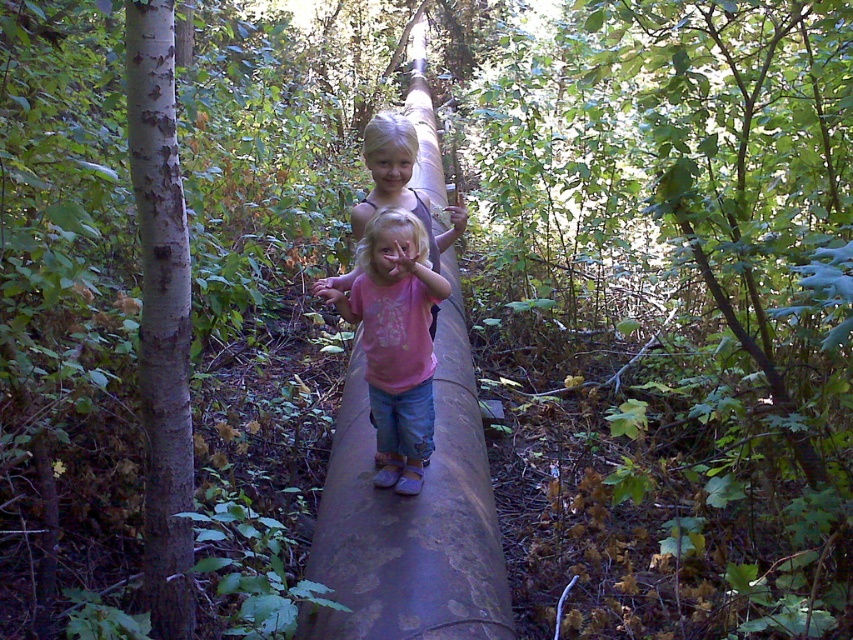
Can you confirm if rusty metal log at center is positioned below white rough bark at left?

No, rusty metal log at center is not below white rough bark at left.

Which of these two, rusty metal log at center or white rough bark at left, stands shorter?

Standing shorter between the two is white rough bark at left.

Does point (459, 410) lie in front of point (158, 166)?

No, it is behind (158, 166).

The width and height of the screenshot is (853, 640). In order to click on rusty metal log at center in this screenshot , I will do `click(412, 518)`.

Does point (151, 92) lie behind point (428, 228)?

That is False.

Who is more distant from viewer, (175, 404) or (364, 204)?

The point (364, 204) is more distant.

Measure the distance between point (164, 568) and camera.

A distance of 7.51 feet exists between point (164, 568) and camera.

This screenshot has width=853, height=640. Identify the location of white rough bark at left. (161, 314).

Is rusty metal log at center to the right of matte pink shirt at center from the viewer's perspective?

No, rusty metal log at center is not to the right of matte pink shirt at center.

Can you confirm if rusty metal log at center is taller than matte pink shirt at center?

Yes.

Does point (467, 444) come in front of point (433, 448)?

That is False.

This screenshot has width=853, height=640. In order to click on rusty metal log at center in this screenshot , I will do `click(412, 518)`.